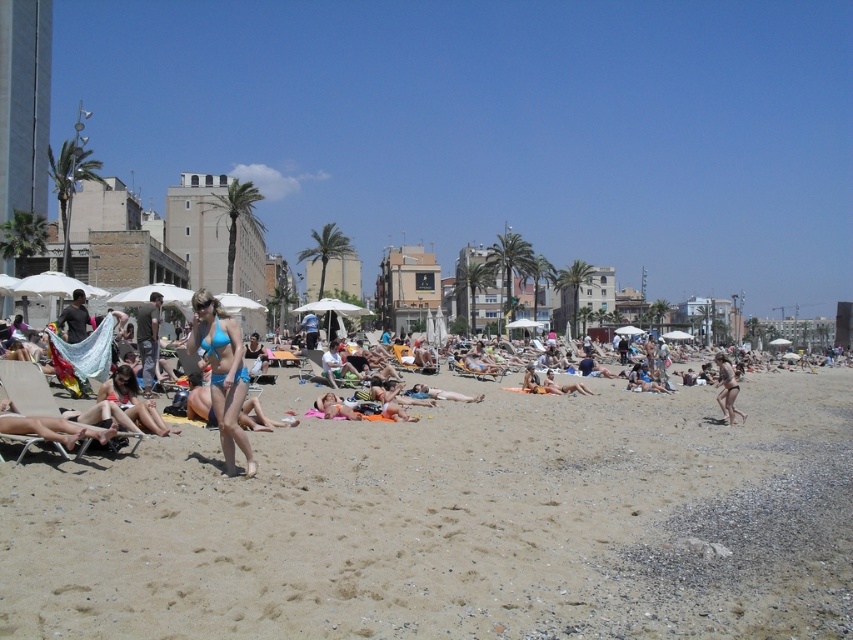
You are standing at the edge of the beach looking towards the water. There is a point marked at coordinates point (457, 524). What type of terrain is located at that point?

The point (457, 524) corresponds to fine grained sand at center.

You are standing on the beach and want to wave to the person wearing the blue bikini at center. Considering the distance, do you think they will be able to see your wave?

The blue bikini at center is 8.87 meters away from you. Since this distance is within the typical visibility range for hand gestures, the person should be able to see your wave.